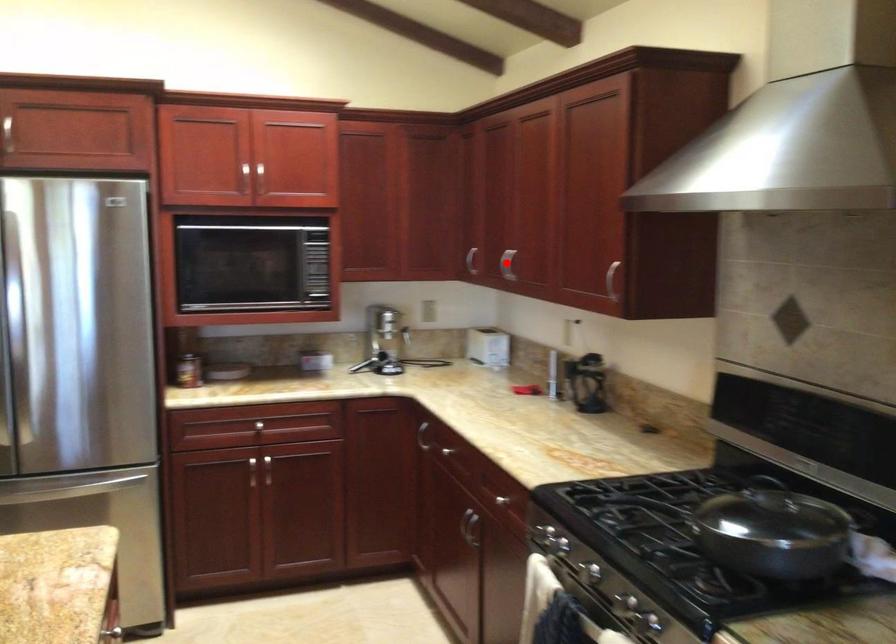
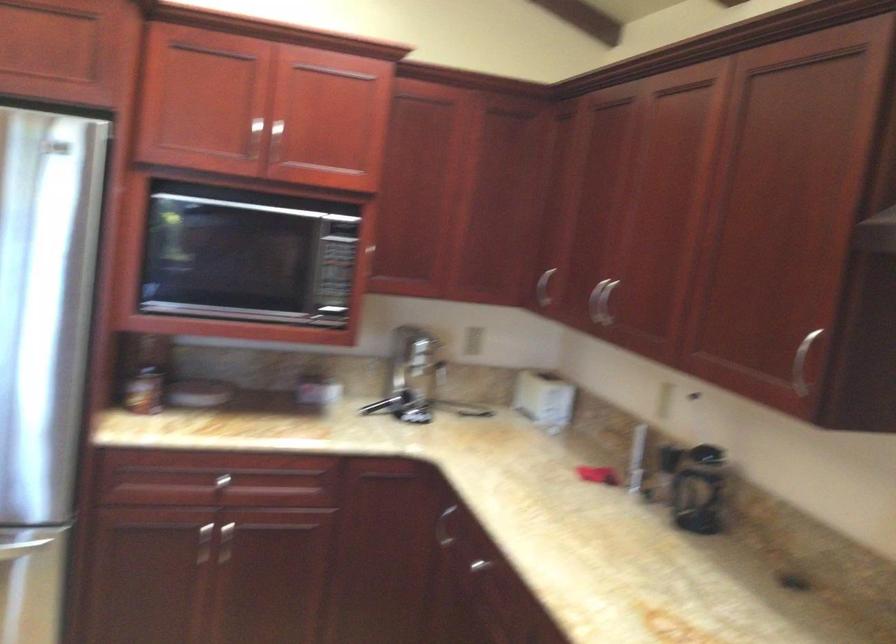
Where in the second image is the point corresponding to the highlighted location from the first image?

(600, 301)